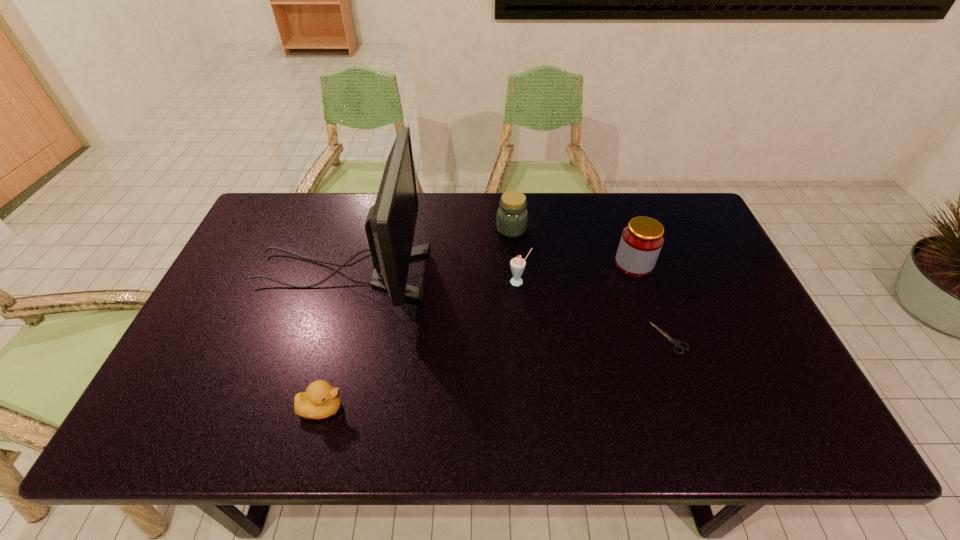
Identify the location of free space that satisfies the following two spatial constraints: 1. on the screen side of the tallest object; 2. on the left side of the shears. The width and height of the screenshot is (960, 540). (323, 338).